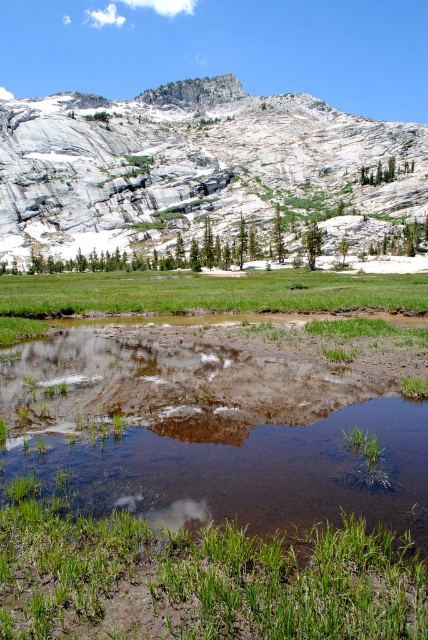
Between clear water at center and green grass at lower center, which one is positioned higher?

clear water at center is above.

Does point (327, 515) come closer to viewer compared to point (255, 572)?

No, it is behind (255, 572).

Where is `clear water at center`? The image size is (428, 640). clear water at center is located at coordinates (211, 433).

Which is below, green grass at lower center or green grass at center?

green grass at lower center is lower down.

This screenshot has width=428, height=640. In order to click on green grass at lower center in this screenshot , I will do `click(199, 579)`.

Between point (45, 566) and point (279, 301), which one is positioned behind?

The point (279, 301) is more distant.

The height and width of the screenshot is (640, 428). I want to click on green grass at lower center, so click(x=199, y=579).

Between white rock mountain at upper center and green grass at lower center, which one has more height?

With more height is white rock mountain at upper center.

Who is shorter, white rock mountain at upper center or green grass at lower center?

green grass at lower center

Is point (362, 250) positioned after point (267, 605)?

That is True.

This screenshot has height=640, width=428. I want to click on white rock mountain at upper center, so click(202, 172).